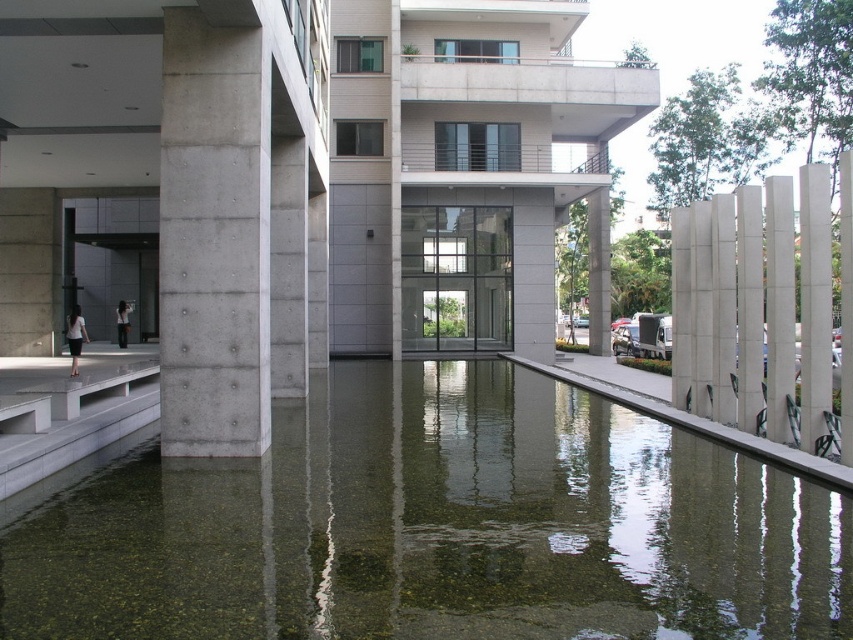
Question: Is clear concrete pool at center above gray concrete pillar at center?

Choices:
 (A) yes
 (B) no

Answer: (B)

Question: Is clear concrete pool at center wider than gray concrete pillar at center?

Choices:
 (A) no
 (B) yes

Answer: (B)

Question: Does clear concrete pool at center appear on the right side of gray concrete pillar at center?

Choices:
 (A) yes
 (B) no

Answer: (A)